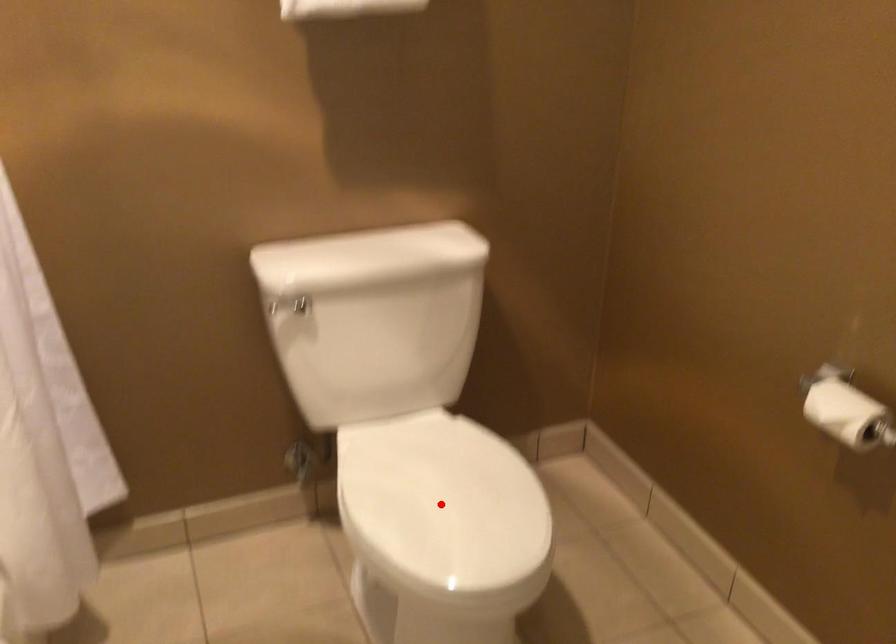
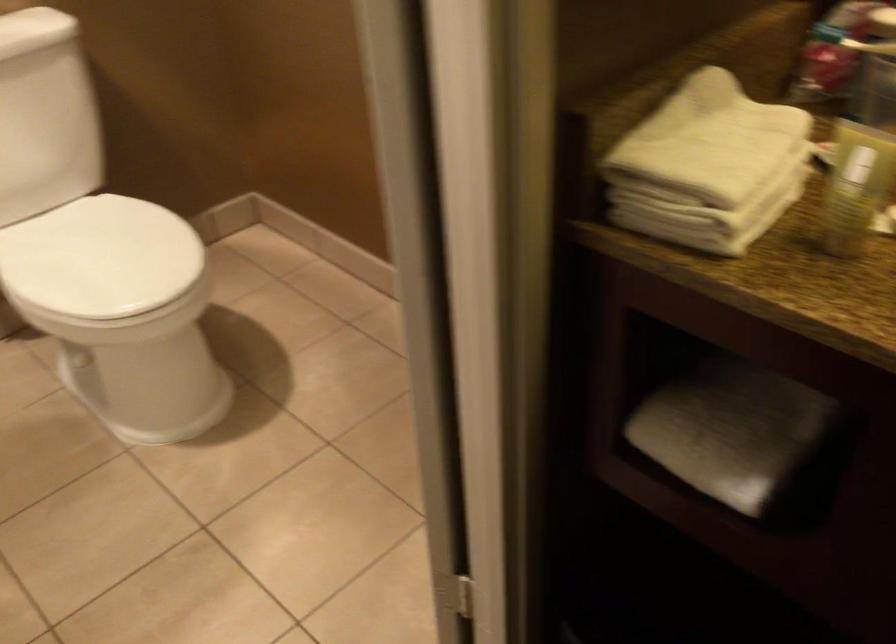
The point at the highlighted location is marked in the first image. Where is the corresponding point in the second image?

(99, 257)